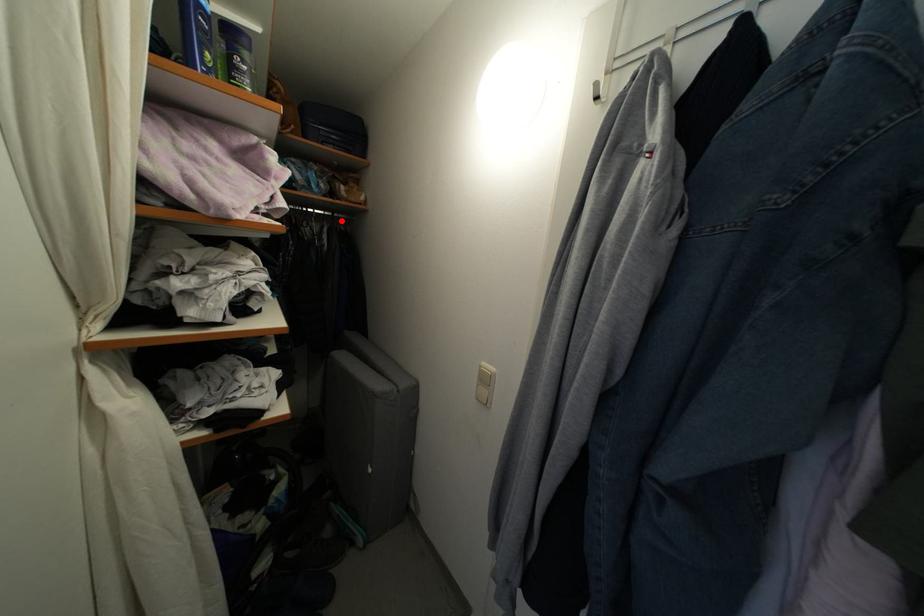
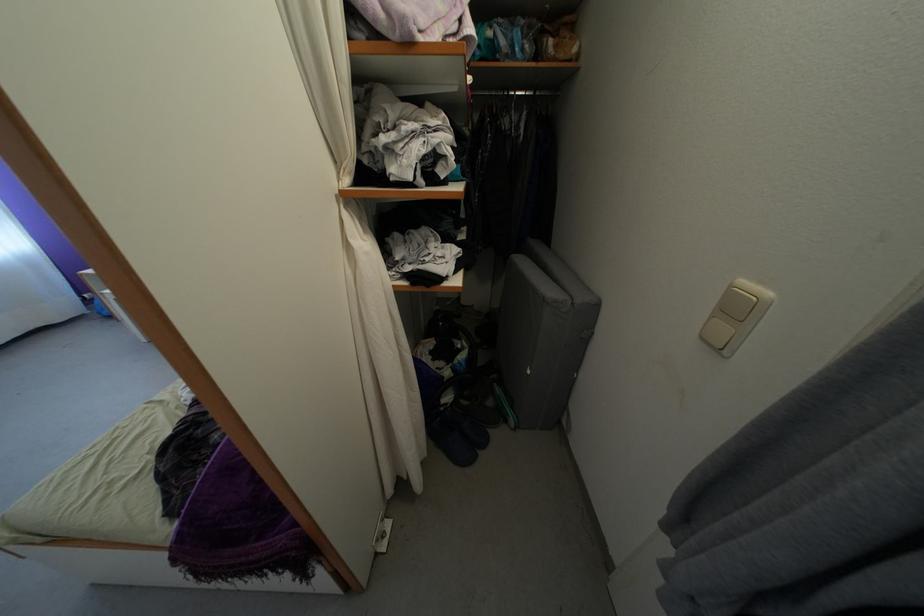
Question: I am providing you with two images of the same scene from different viewpoints. In image1, a red point is highlighted. Considering the same 3D point in image2, which of the following is correct?

Choices:
 (A) It is closer
 (B) It is farther

Answer: (A)